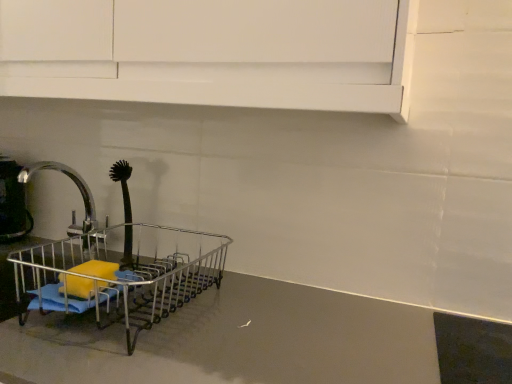
Question: Based on their sizes in the image, would you say black rubber brush at left is bigger or smaller than metallic silver dish rack at left?

Choices:
 (A) big
 (B) small

Answer: (B)

Question: Does point tap(128, 162) appear closer or farther from the camera than point tap(64, 288)?

Choices:
 (A) closer
 (B) farther

Answer: (B)

Question: Estimate the real-world distances between objects in this image. Which object is farther from the silver metallic faucet at left?

Choices:
 (A) metallic gray counter top at center
 (B) metallic silver dish rack at left
 (C) black rubber brush at left
 (D) metallic silver kettle at left

Answer: (A)

Question: Estimate the real-world distances between objects in this image. Which object is closer to the metallic silver dish rack at left?

Choices:
 (A) black rubber brush at left
 (B) metallic silver kettle at left
 (C) silver metallic faucet at left
 (D) metallic gray counter top at center

Answer: (A)